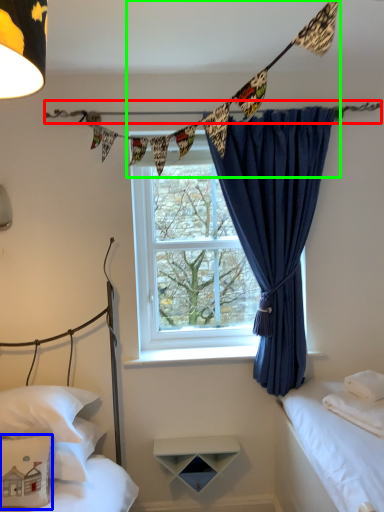
Question: Which is nearer to the clothesline (highlighted by a red box)? pillow (highlighted by a blue box) or clothesline (highlighted by a green box).

Choices:
 (A) pillow
 (B) clothesline

Answer: (B)